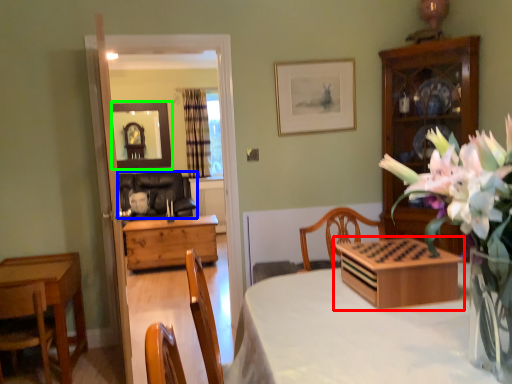
Question: Estimate the real-world distances between objects in this image. Which object is farther from tableware (highlighted by a red box), chair (highlighted by a blue box) or mirror (highlighted by a green box)?

Choices:
 (A) chair
 (B) mirror

Answer: (B)